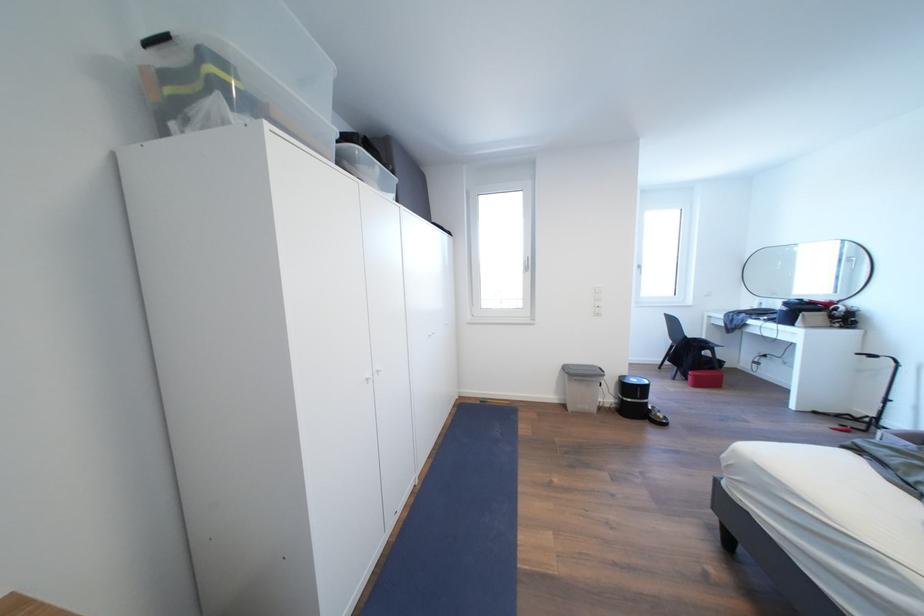
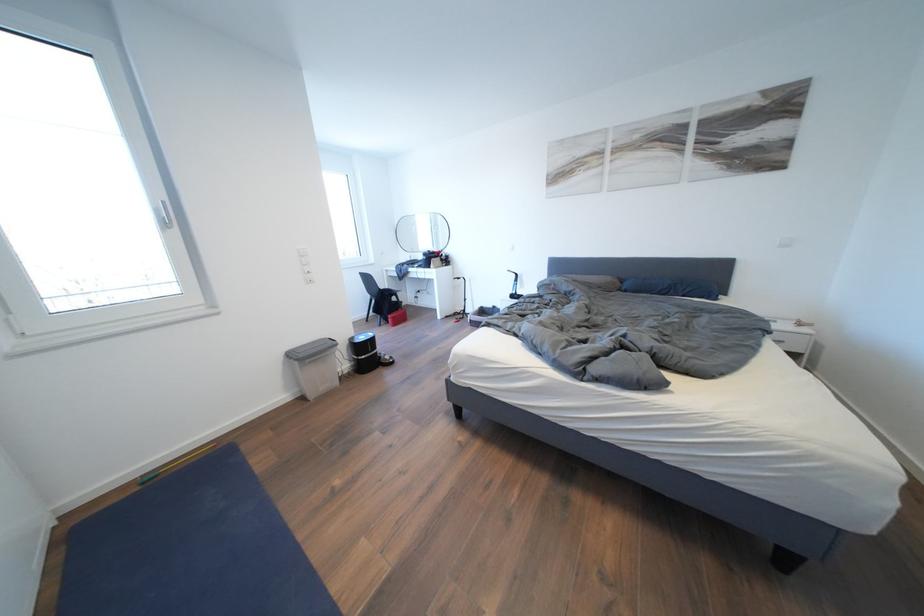
Question: How did the camera likely rotate?

Choices:
 (A) Left
 (B) Right
 (C) Up
 (D) Down

Answer: (B)